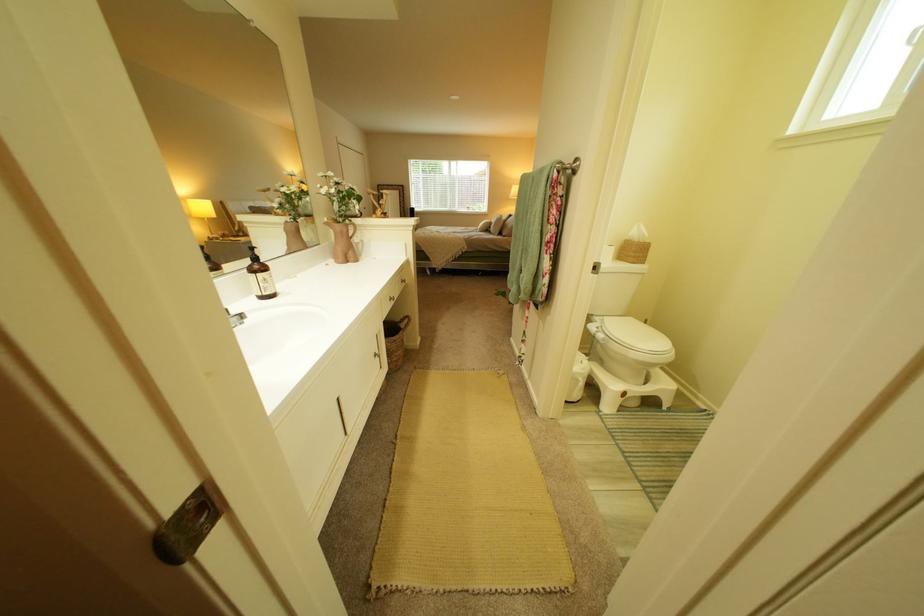
The width and height of the screenshot is (924, 616). What do you see at coordinates (591, 336) in the screenshot? I see `the toilet flush lever` at bounding box center [591, 336].